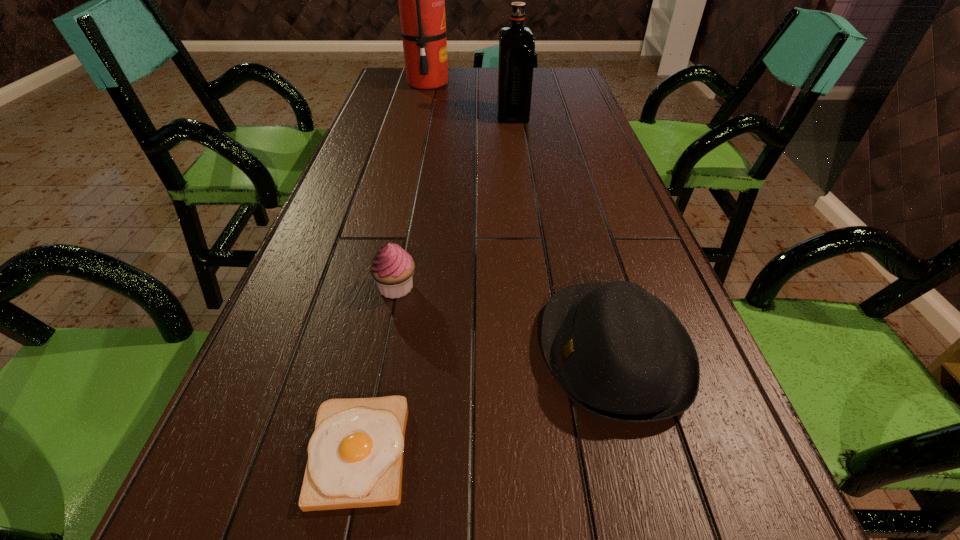
At what (x,y) coordinates should I click in order to perform the action: click on object at the far left corner. Please return your answer as a coordinate pair (x, y). The height and width of the screenshot is (540, 960). Looking at the image, I should click on (421, 0).

You are a GUI agent. You are given a task and a screenshot of the screen. Output one action in this format:
    pyautogui.click(x=<x>, y=<y>)
    Task: Click on the vacant space at the far edge of the desktop
    
    Given the screenshot: What is the action you would take?
    pyautogui.click(x=473, y=89)

In the image, there is a desktop. What are the coordinates of `vacant space at the left edge` in the screenshot? It's located at pyautogui.click(x=242, y=477).

This screenshot has width=960, height=540. In the image, there is a desktop. In order to click on vacant region at the right edge in this screenshot , I will do (612, 267).

Locate an element on the screen. This screenshot has height=540, width=960. free space at the far left corner of the desktop is located at coordinates (415, 89).

The width and height of the screenshot is (960, 540). Find the location of `free space between the liquor and the fedora`. free space between the liquor and the fedora is located at coordinates (564, 233).

Where is `vacant region between the fire extinguisher and the fedora`? This screenshot has width=960, height=540. vacant region between the fire extinguisher and the fedora is located at coordinates (521, 218).

The image size is (960, 540). I want to click on empty space between the liquor and the cupcake, so click(x=455, y=201).

You are a GUI agent. You are given a task and a screenshot of the screen. Output one action in this format:
    pyautogui.click(x=<x>, y=<y>)
    Task: Click on the vacant area between the cupcake and the farthest object
    This screenshot has width=960, height=540.
    Given the screenshot: What is the action you would take?
    pyautogui.click(x=412, y=185)

The image size is (960, 540). Identify the location of vacant area that lies between the toast and the second farthest object. (436, 284).